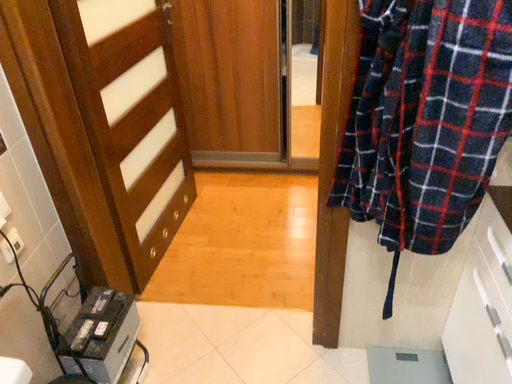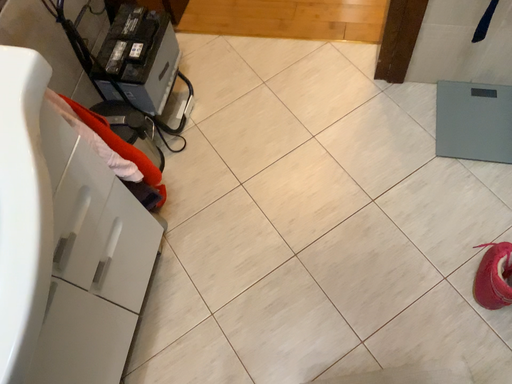
Question: Which way did the camera rotate in the video?

Choices:
 (A) rotated upward
 (B) rotated downward

Answer: (B)